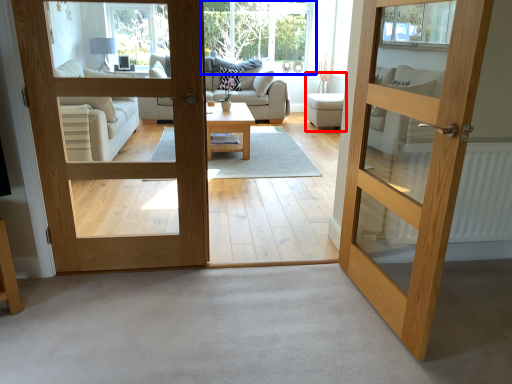
Question: Which of the following is the closest to the observer, armchair (highlighted by a red box) or window (highlighted by a blue box)?

Choices:
 (A) armchair
 (B) window

Answer: (A)